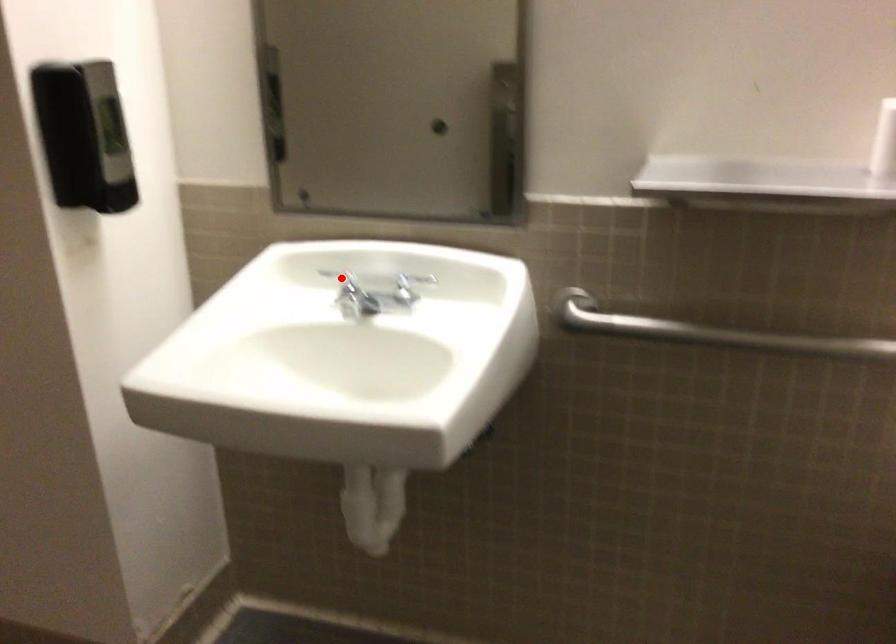
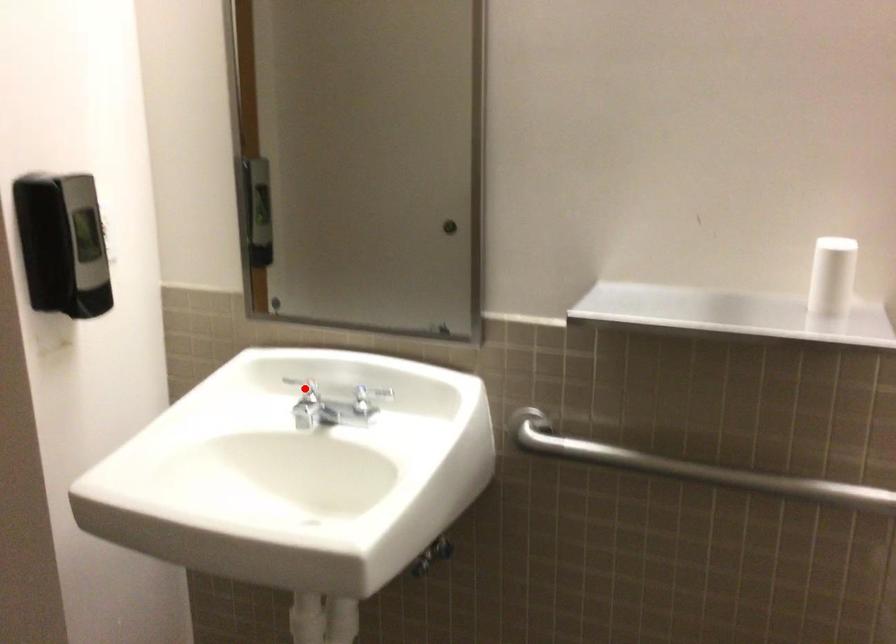
I am providing you with two images of the same scene from different viewpoints. A red point is marked on the first image and another point is marked on the second image. Is the red point in image1 aligned with the point shown in image2?

Yes